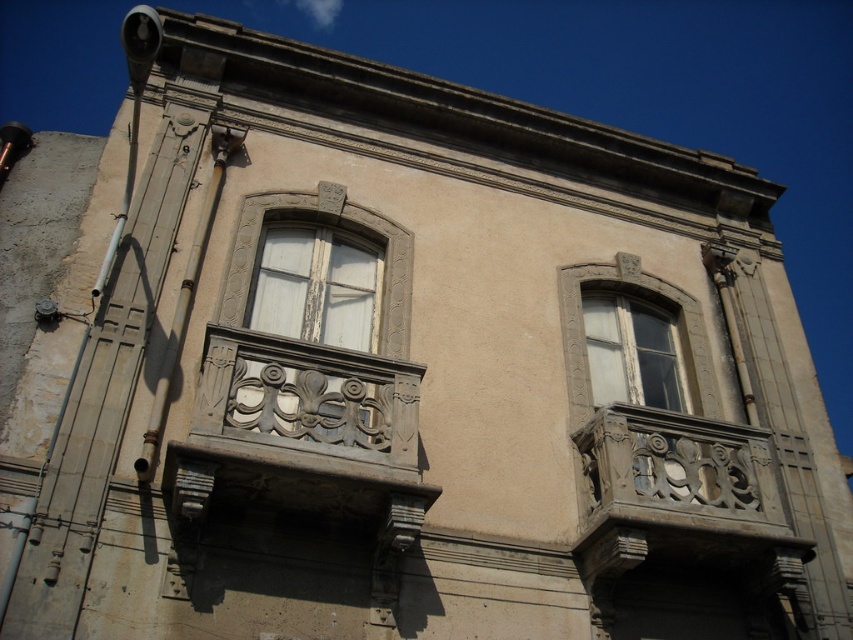
You are standing in front of the building and want to take a photo of the carved stone balcony at center. Which coordinate should you aim your camera at?

You should aim your camera at point (302, 433) to capture the carved stone balcony at center.

You are standing in front of the building and want to take a photo of the white wood window at center. If your camera can focus on objects within 100 feet, will you need to move closer or farther away to capture a clear image?

The white wood window at center is 118.58 feet from the camera, which is beyond the camera focus range of 100 feet. You need to move closer to the white wood window at center to ensure it is within the focus range.

You are standing in front of the building and notice both the carved stone balcony at center and the white wood window at center. From your perspective, which object is positioned to the left?

The white wood window at center is to the left of the carved stone balcony at center.